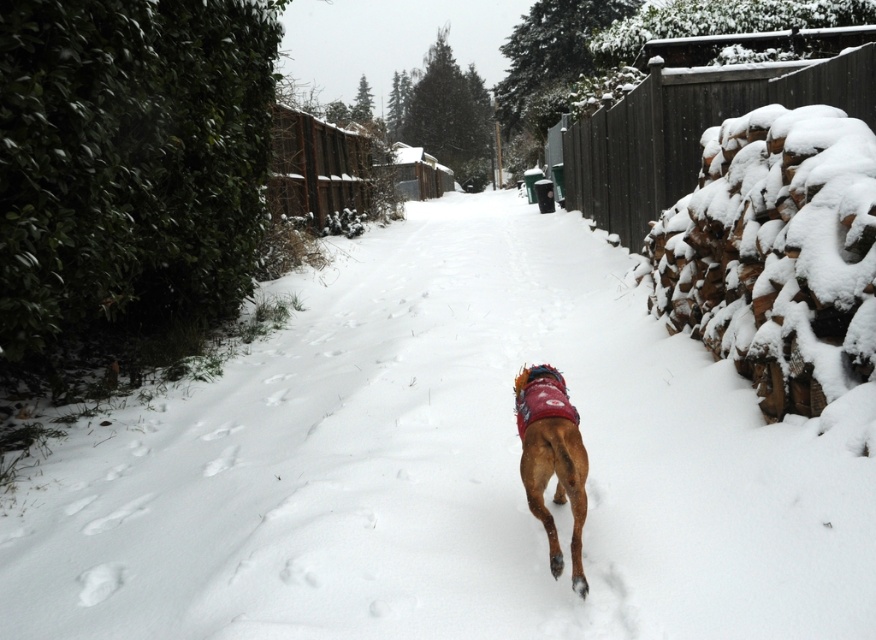
You are standing at point (447,468) in the winter scene. What do you see immediately around you?

You see white fluffy snow at center immediately around you at point (447,468).